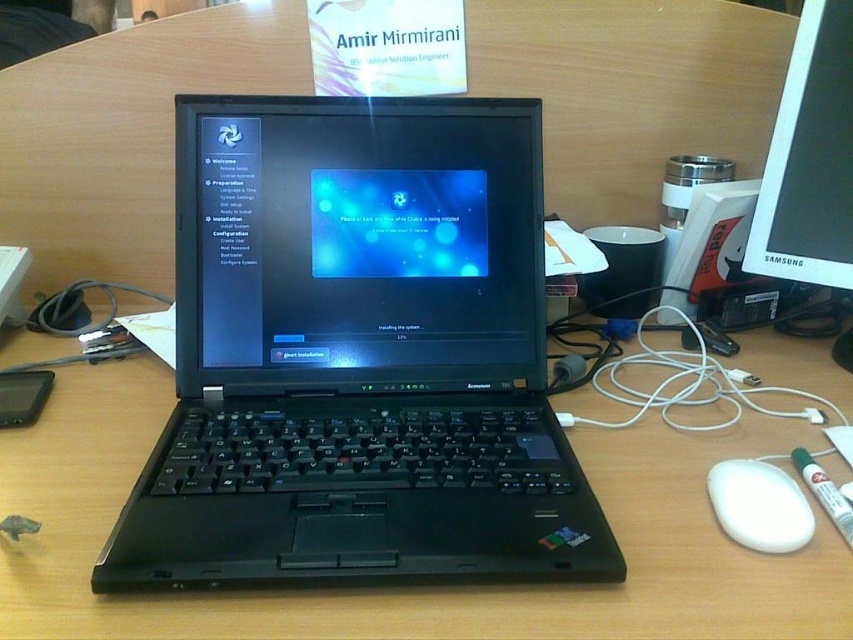
Question: Which object is the farthest from the black matte laptop at center?

Choices:
 (A) wooden table at center
 (B) white glossy monitor at center
 (C) white matte mouse at lower right

Answer: (B)

Question: Does black matte laptop at center appear on the right side of wooden table at center?

Choices:
 (A) no
 (B) yes

Answer: (A)

Question: Does black matte laptop at center appear on the right side of wooden table at center?

Choices:
 (A) no
 (B) yes

Answer: (A)

Question: Can you confirm if black matte laptop at center is positioned below wooden table at center?

Choices:
 (A) no
 (B) yes

Answer: (A)

Question: Which object is positioned farthest from the white matte mouse at lower right?

Choices:
 (A) wooden table at center
 (B) black glossy laptop at center
 (C) black matte laptop at center
 (D) white glossy monitor at center

Answer: (B)

Question: Estimate the real-world distances between objects in this image. Which object is farther from the white matte mouse at lower right?

Choices:
 (A) black glossy laptop at center
 (B) wooden table at center
 (C) white glossy monitor at center

Answer: (A)